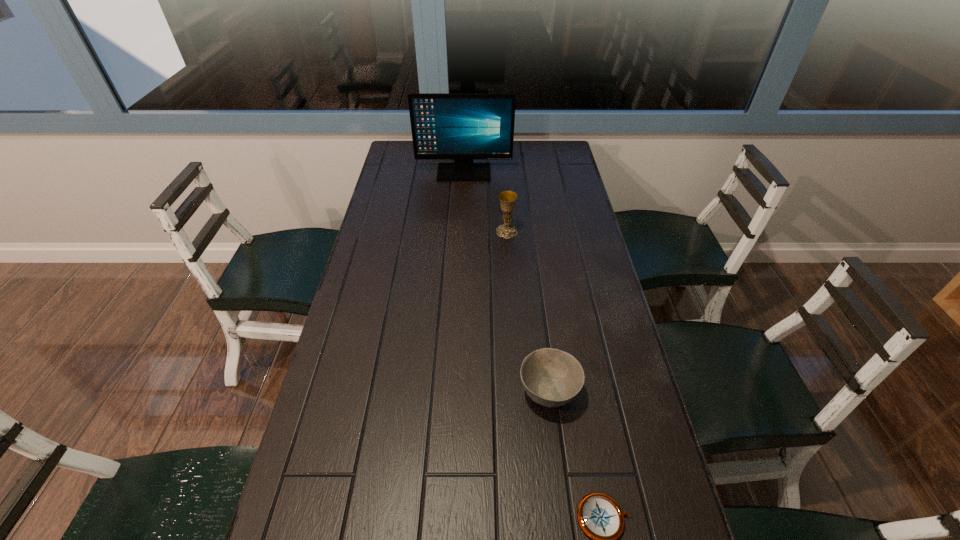
Locate an element on the screen. The image size is (960, 540). empty space between the bowl and the farthest object is located at coordinates click(506, 283).

The image size is (960, 540). I want to click on free space that is in between the chalice and the bowl, so click(x=528, y=312).

Point out which object is positioned as the third nearest to the third nearest object. Please provide its 2D coordinates. Your answer should be formatted as a tuple, i.e. [(x, y)], where the tuple contains the x and y coordinates of a point satisfying the conditions above.

[(600, 517)]

Identify which object is the closest to the monitor. Please provide its 2D coordinates. Your answer should be formatted as a tuple, i.e. [(x, y)], where the tuple contains the x and y coordinates of a point satisfying the conditions above.

[(507, 199)]

Identify the location of vacant space that satisfies the following two spatial constraints: 1. on the front side of the third farthest object; 2. on the right side of the second tallest object. (518, 393).

Find the location of `vacant point that satisfies the following two spatial constraints: 1. on the screen side of the second farthest object; 2. on the right side of the monitor`. vacant point that satisfies the following two spatial constraints: 1. on the screen side of the second farthest object; 2. on the right side of the monitor is located at coordinates (461, 232).